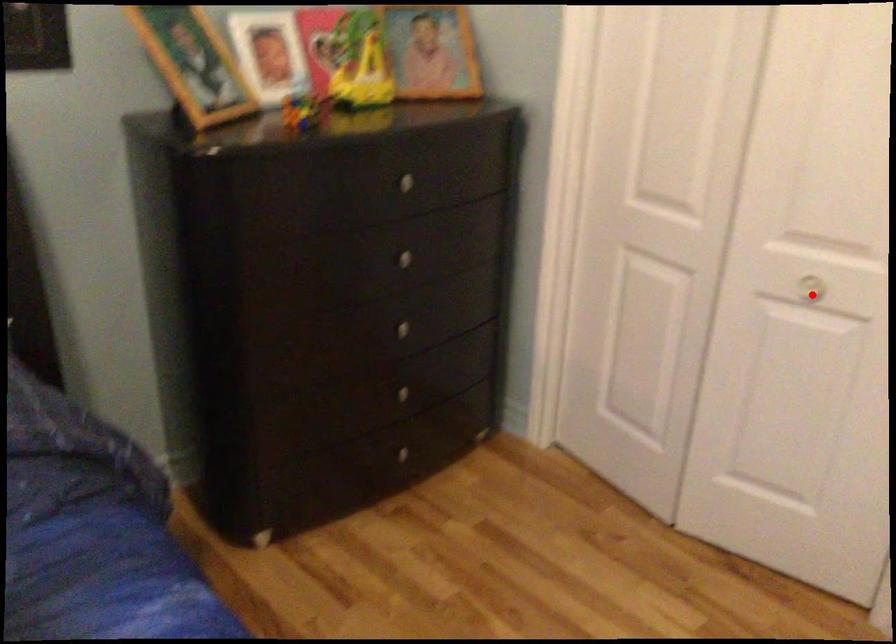
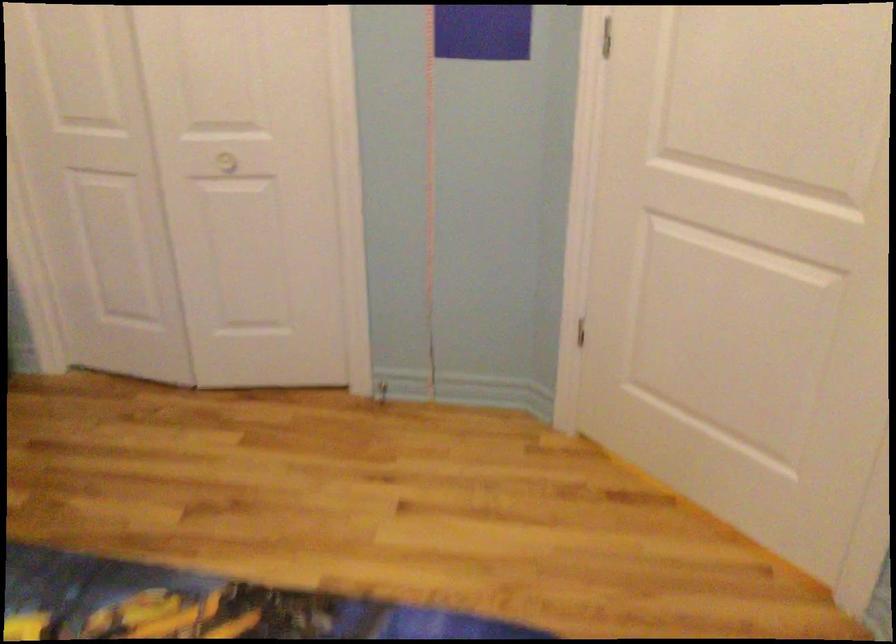
The point at the highlighted location is marked in the first image. Where is the corresponding point in the second image?

(227, 162)